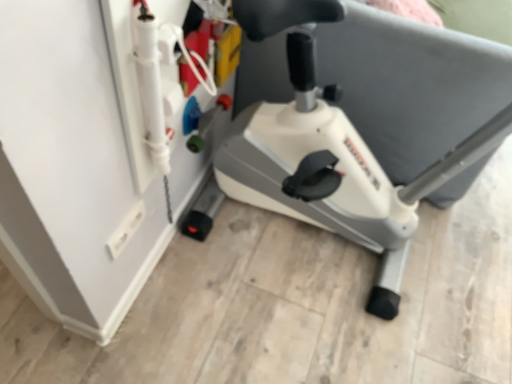
Identify the location of vacant space in white plastic stationary bicycle at center (from a real-world perspective). This screenshot has width=512, height=384. (324, 248).